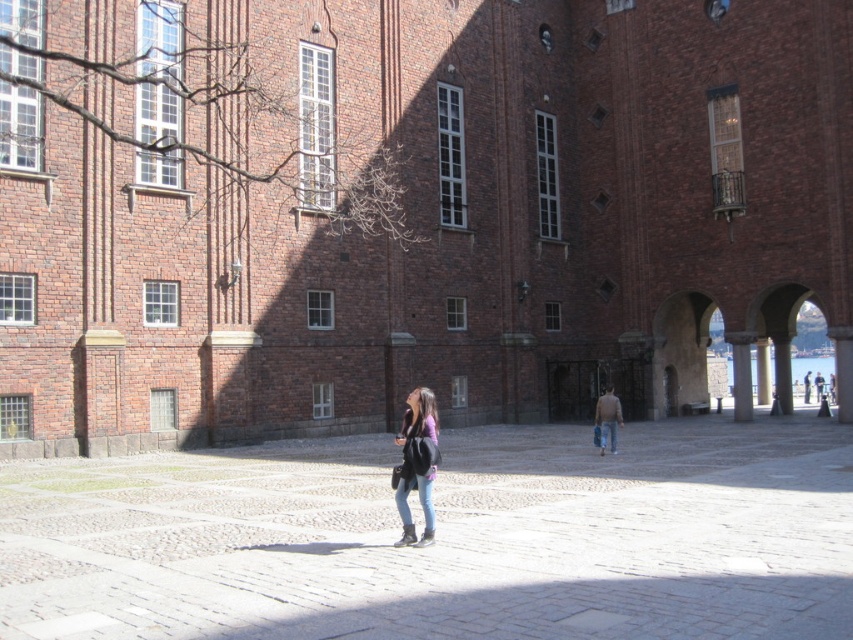
Who is positioned more to the left, smooth stone courtyard at center or matte black backpack at center?

Positioned to the left is matte black backpack at center.

Which of these two, smooth stone courtyard at center or matte black backpack at center, stands shorter?

smooth stone courtyard at center is shorter.

Describe the element at coordinates (444, 538) in the screenshot. This screenshot has height=640, width=853. I see `smooth stone courtyard at center` at that location.

I want to click on smooth stone courtyard at center, so click(x=444, y=538).

Does point (376, 632) come in front of point (804, 394)?

That is True.

The height and width of the screenshot is (640, 853). Find the location of `smooth stone courtyard at center`. smooth stone courtyard at center is located at coordinates (444, 538).

Is matte black backpack at center further to camera compared to denim jacket at center?

That is False.

Find the location of a particular element. The image size is (853, 640). matte black backpack at center is located at coordinates (416, 465).